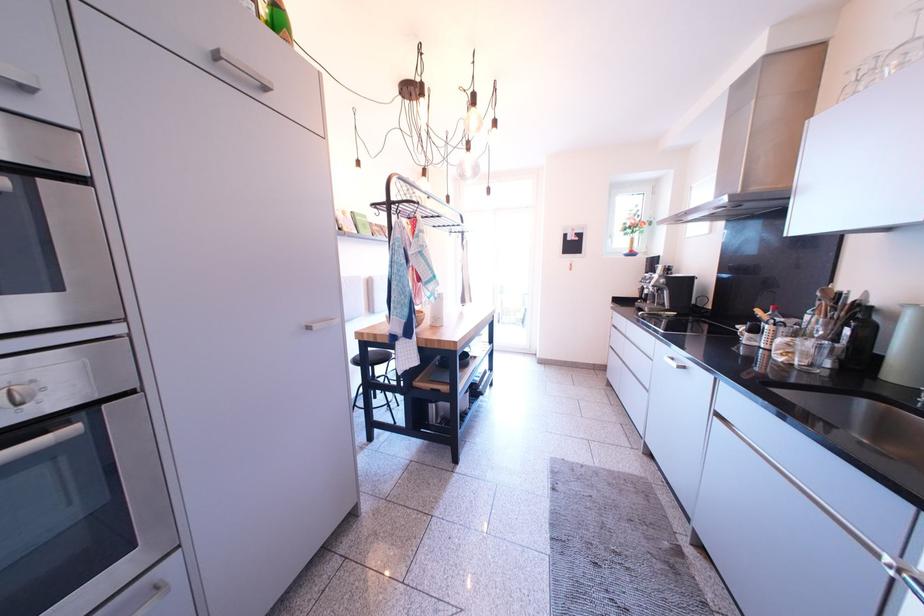
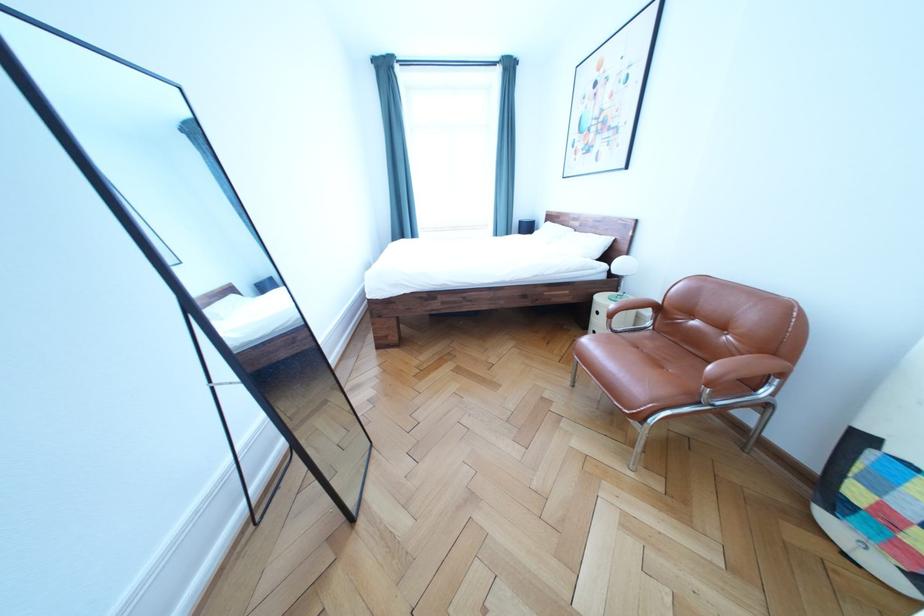
Question: I am providing you with two images of the same scene from different viewpoints. Which of the following objects are not visible in image2?

Choices:
 (A) white pillow
 (B) chair sitting surface
 (C) orange device knob
 (D) nightstand drawer handle

Answer: (B)